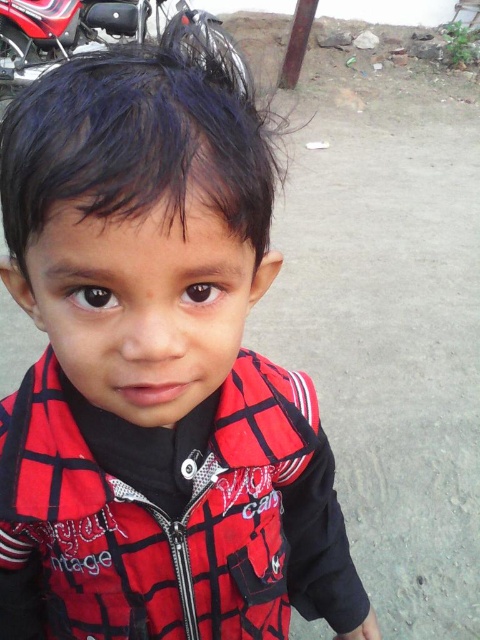
Question: Which point is closer to the camera?

Choices:
 (A) coord(204,593)
 (B) coord(144,24)

Answer: (A)

Question: Which of the following is the farthest from the observer?

Choices:
 (A) (21, 52)
 (B) (32, 371)

Answer: (A)

Question: Which of the following is the farthest from the observer?

Choices:
 (A) (21, 52)
 (B) (227, 538)

Answer: (A)

Question: Observing the image, what is the correct spatial positioning of red plaid jacket at center in reference to shiny metallic motorcycle at upper left?

Choices:
 (A) right
 (B) left

Answer: (A)

Question: Does red plaid jacket at center have a lesser width compared to shiny metallic motorcycle at upper left?

Choices:
 (A) yes
 (B) no

Answer: (A)

Question: Can you confirm if red plaid jacket at center is thinner than shiny metallic motorcycle at upper left?

Choices:
 (A) yes
 (B) no

Answer: (A)